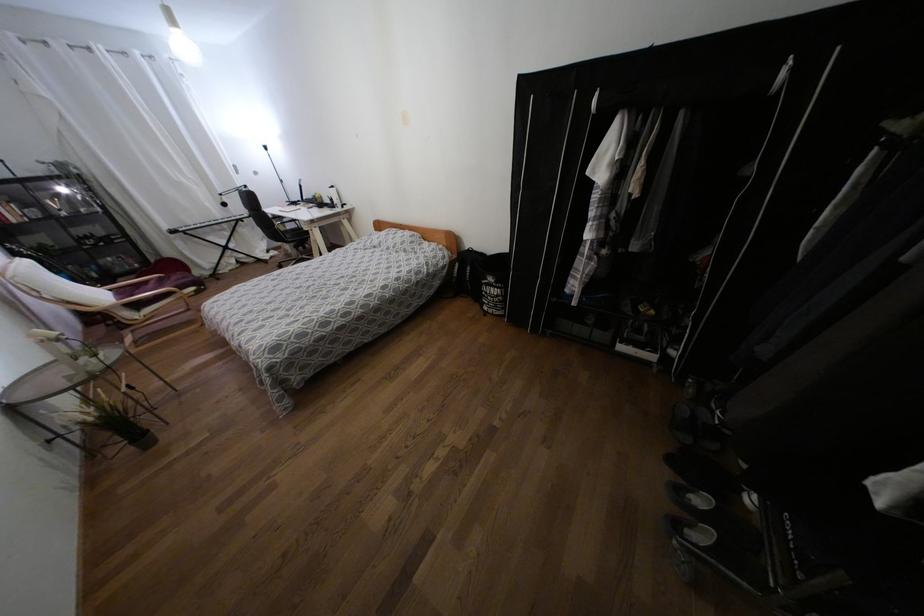
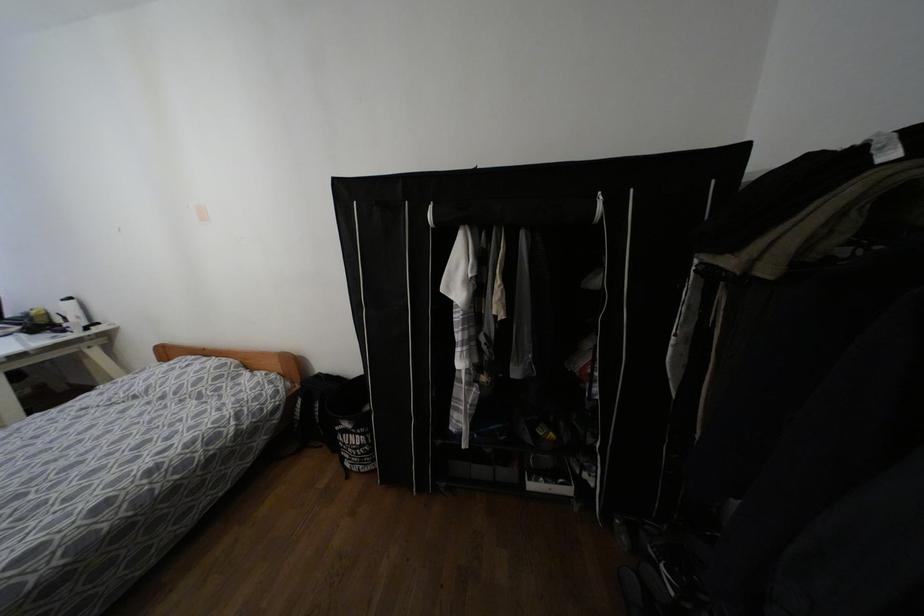
The point at (332, 187) is marked in the first image. Where is the corresponding point in the second image?

(68, 299)